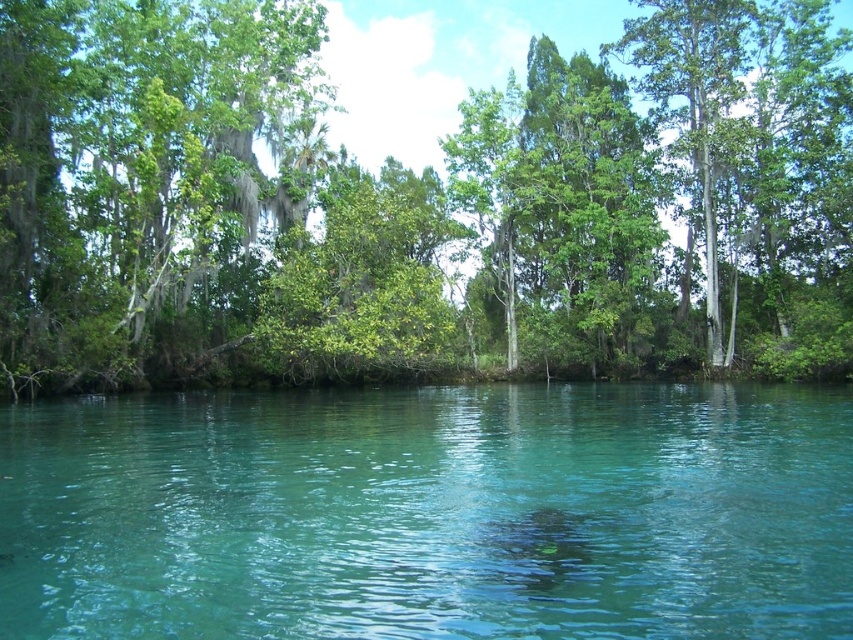
Question: Can you confirm if green leafy tree at center is positioned above green leafy trees at left?

Choices:
 (A) yes
 (B) no

Answer: (A)

Question: Considering the real-world distances, which object is closest to the green leafy trees at left?

Choices:
 (A) green leafy tree at center
 (B) clear water at center

Answer: (A)

Question: Can you confirm if green leafy tree at center is positioned below clear water at center?

Choices:
 (A) no
 (B) yes

Answer: (A)

Question: Which object is positioned farthest from the green leafy tree at center?

Choices:
 (A) clear water at center
 (B) green leafy trees at left

Answer: (A)

Question: Which of the following is the closest to the observer?

Choices:
 (A) (39, 189)
 (B) (16, 545)
 (C) (9, 262)

Answer: (B)

Question: From the image, what is the correct spatial relationship of clear water at center in relation to green leafy trees at left?

Choices:
 (A) left
 (B) right

Answer: (B)